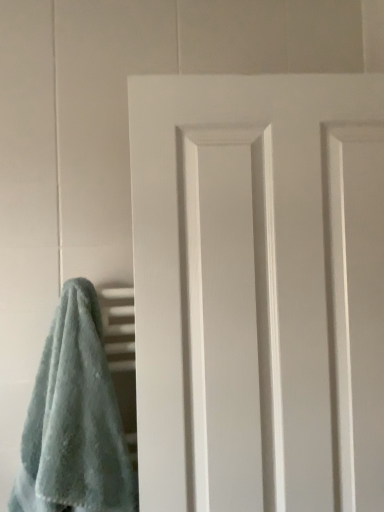
Question: Does soft blue towel at lower left turn towards white matte door at center?

Choices:
 (A) no
 (B) yes

Answer: (A)

Question: From the image's perspective, is soft blue towel at lower left under white matte door at center?

Choices:
 (A) no
 (B) yes

Answer: (B)

Question: Is soft blue towel at lower left facing away from white matte door at center?

Choices:
 (A) no
 (B) yes

Answer: (A)

Question: Is soft blue towel at lower left not close to white matte door at center?

Choices:
 (A) no
 (B) yes

Answer: (A)

Question: Does soft blue towel at lower left come in front of white matte door at center?

Choices:
 (A) yes
 (B) no

Answer: (A)

Question: Is soft blue towel at lower left shorter than white matte door at center?

Choices:
 (A) yes
 (B) no

Answer: (A)

Question: From a real-world perspective, is white matte door at center physically above soft blue towel at lower left?

Choices:
 (A) no
 (B) yes

Answer: (B)

Question: Is white matte door at center aimed at soft blue towel at lower left?

Choices:
 (A) yes
 (B) no

Answer: (B)

Question: Considering the relative sizes of white matte door at center and soft blue towel at lower left in the image provided, is white matte door at center smaller than soft blue towel at lower left?

Choices:
 (A) no
 (B) yes

Answer: (A)

Question: From the image's perspective, does white matte door at center appear lower than soft blue towel at lower left?

Choices:
 (A) yes
 (B) no

Answer: (B)

Question: Is white matte door at center wider than soft blue towel at lower left?

Choices:
 (A) no
 (B) yes

Answer: (A)

Question: Does white matte door at center have a lesser height compared to soft blue towel at lower left?

Choices:
 (A) yes
 (B) no

Answer: (B)

Question: From the image's perspective, is soft blue towel at lower left positioned above or below white matte door at center?

Choices:
 (A) below
 (B) above

Answer: (A)